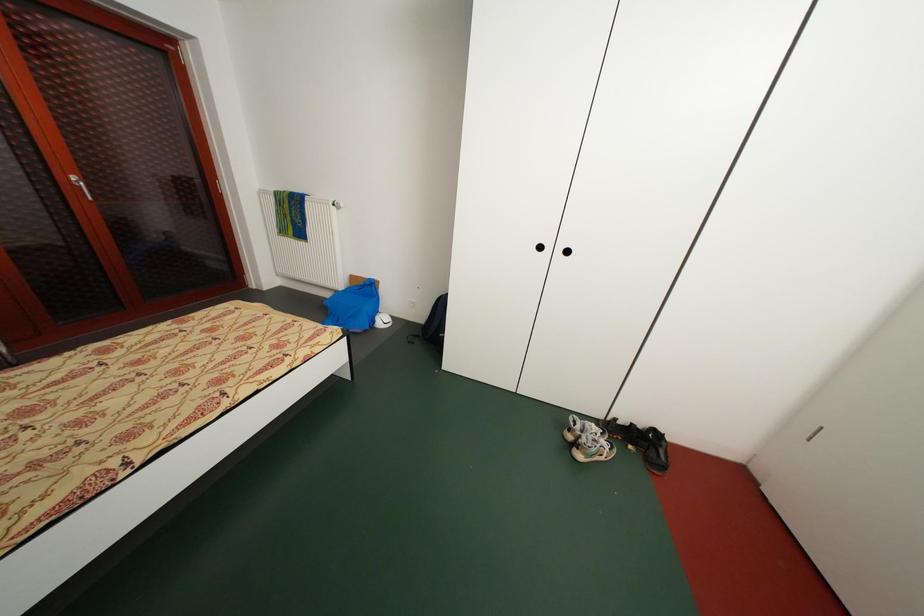
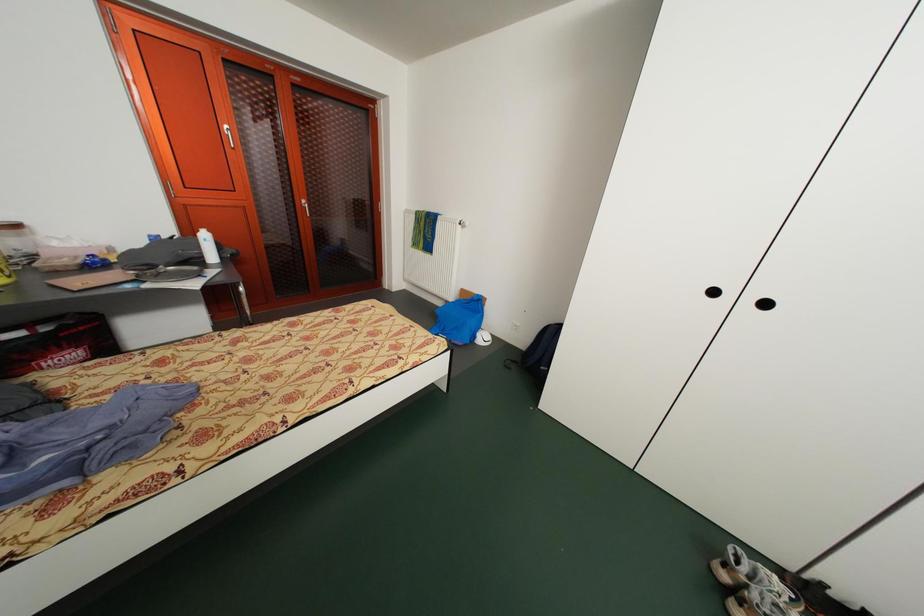
The images are taken continuously from a first-person perspective. In which direction are you moving?

The cameraman walked toward left, forward.